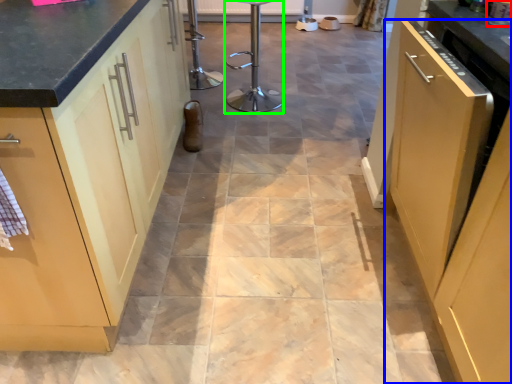
Question: Which is farther away from appliance (highlighted by a red box)? cabinetry (highlighted by a blue box) or bar stool (highlighted by a green box)?

Choices:
 (A) cabinetry
 (B) bar stool

Answer: (B)